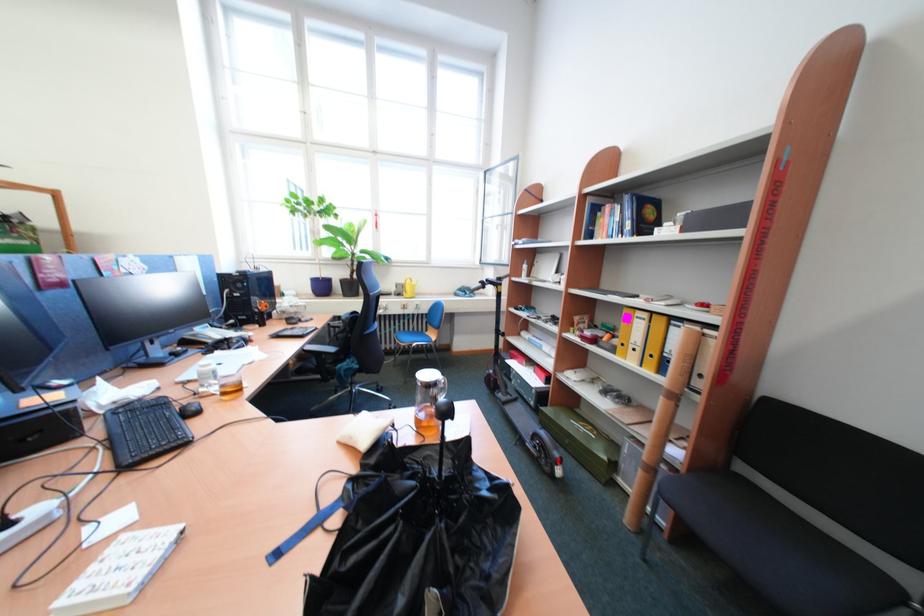
Where would you pull the blue binder finger hole? Please return your answer as a coordinate pair (x, y).

(304, 531)